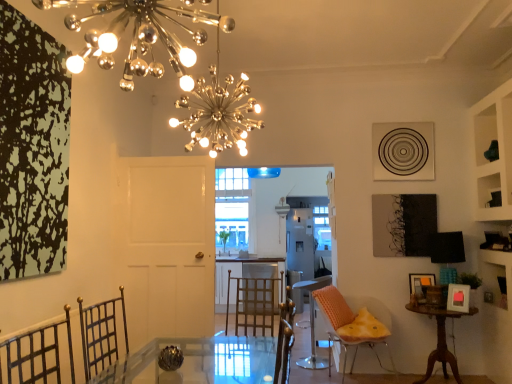
Question: From the image's perspective, would you say metallic spherical lights at upper center is positioned over orange textured chair at right, arranged as the first chair when viewed from the front?

Choices:
 (A) yes
 (B) no

Answer: (A)

Question: Is metallic spherical lights at upper center behind orange textured chair at right, the second chair viewed from the back?

Choices:
 (A) no
 (B) yes

Answer: (A)

Question: Would you say metallic spherical lights at upper center is a long distance from orange textured chair at right, arranged as the first chair when viewed from the front?

Choices:
 (A) no
 (B) yes

Answer: (B)

Question: Is metallic spherical lights at upper center looking in the opposite direction of orange textured chair at right, arranged as the first chair when viewed from the front?

Choices:
 (A) no
 (B) yes

Answer: (A)

Question: Is metallic spherical lights at upper center to the right of orange textured chair at right, the second chair viewed from the back, from the viewer's perspective?

Choices:
 (A) yes
 (B) no

Answer: (B)

Question: Could you tell me if metallic spherical lights at upper center is turned towards orange textured chair at right, the second chair viewed from the back?

Choices:
 (A) no
 (B) yes

Answer: (A)

Question: Are orange textured chair at right, the second chair viewed from the back, and satin white refrigerator at center making contact?

Choices:
 (A) yes
 (B) no

Answer: (B)

Question: Is orange textured chair at right, arranged as the first chair when viewed from the front, oriented towards satin white refrigerator at center?

Choices:
 (A) yes
 (B) no

Answer: (B)

Question: Is the depth of orange textured chair at right, arranged as the first chair when viewed from the front, less than that of satin white refrigerator at center?

Choices:
 (A) no
 (B) yes

Answer: (B)

Question: From a real-world perspective, is orange textured chair at right, the second chair viewed from the back, physically above satin white refrigerator at center?

Choices:
 (A) no
 (B) yes

Answer: (A)

Question: From a real-world perspective, is orange textured chair at right, the second chair viewed from the back, located beneath satin white refrigerator at center?

Choices:
 (A) yes
 (B) no

Answer: (A)

Question: Is orange textured chair at right, arranged as the first chair when viewed from the front, completely or partially outside of satin white refrigerator at center?

Choices:
 (A) yes
 (B) no

Answer: (A)

Question: From the image's perspective, is clear glass window at center on white matte door at center?

Choices:
 (A) yes
 (B) no

Answer: (A)